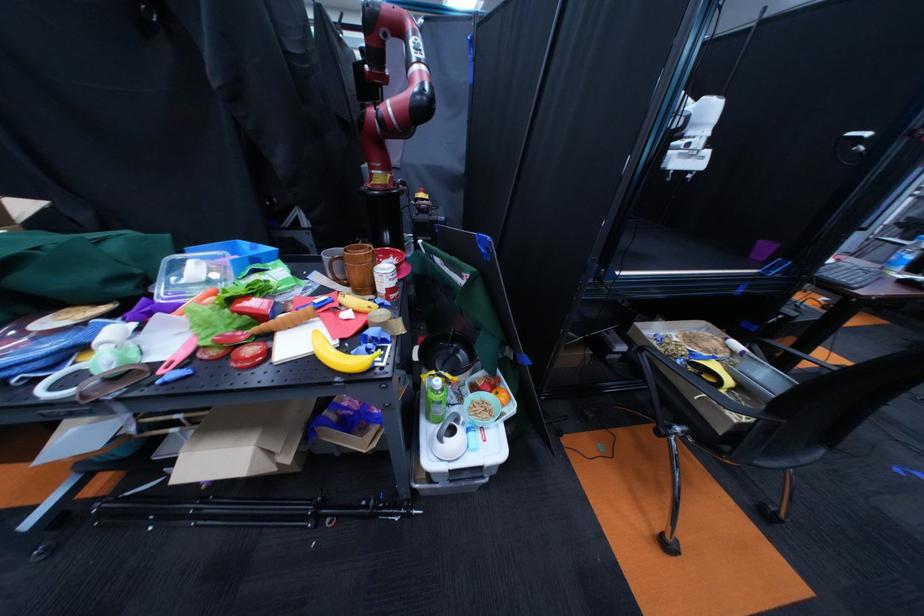
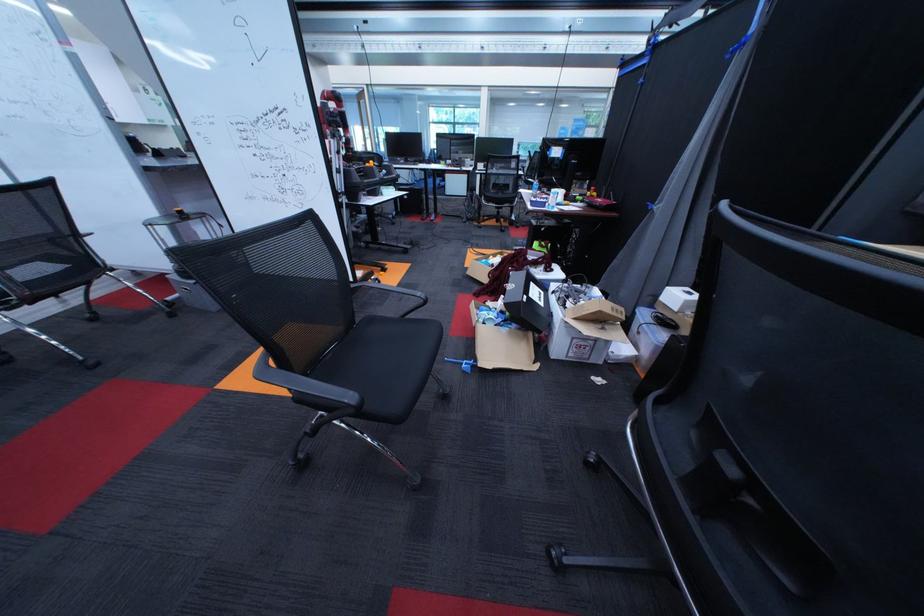
Question: I am providing you with two images of the same scene from different viewpoints. Which of the following objects are not visible in image2?

Choices:
 (A) patterned sofa pillow
 (B) white box
 (C) clear plastic box
 (D) white pitcher handle

Answer: (D)